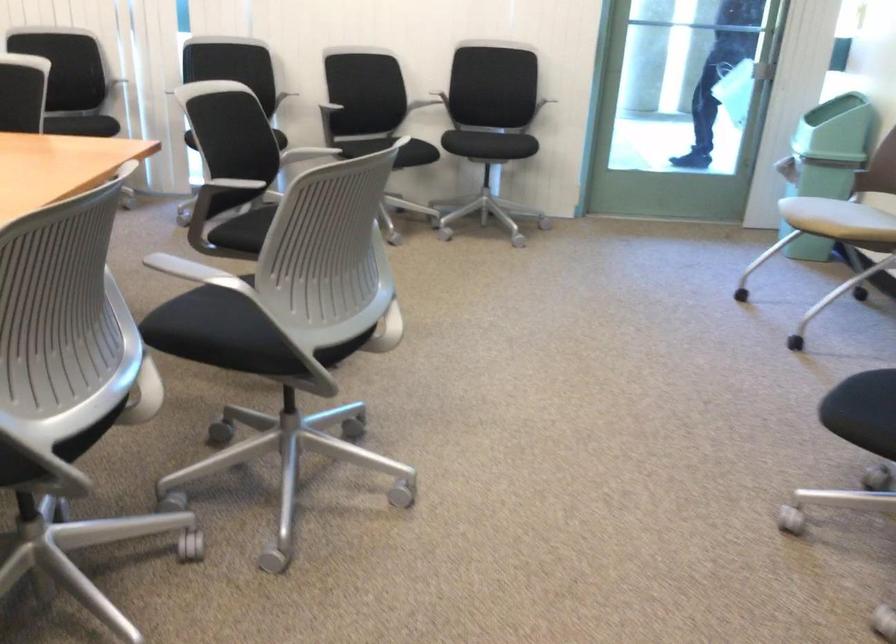
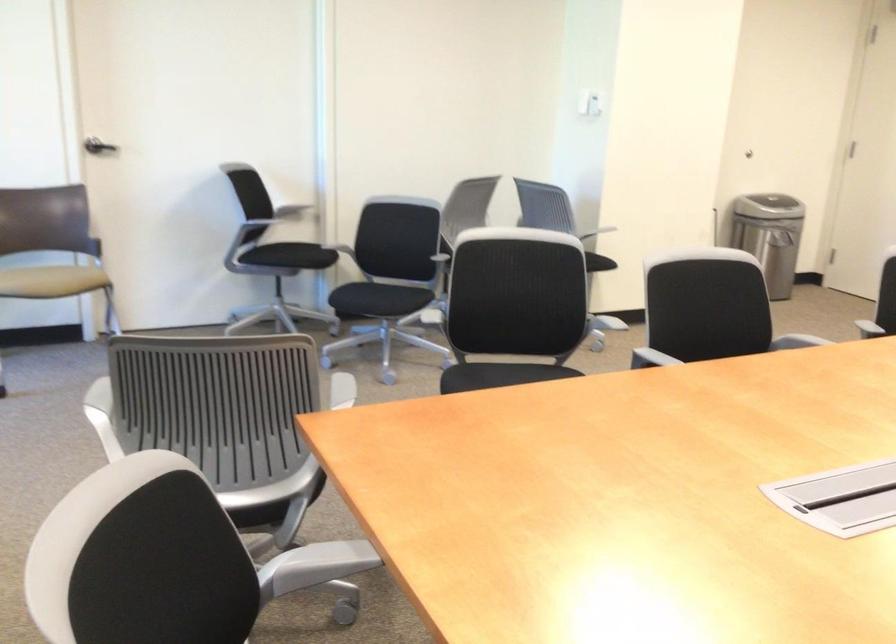
The point at (345, 249) is marked in the first image. Where is the corresponding point in the second image?

(513, 307)